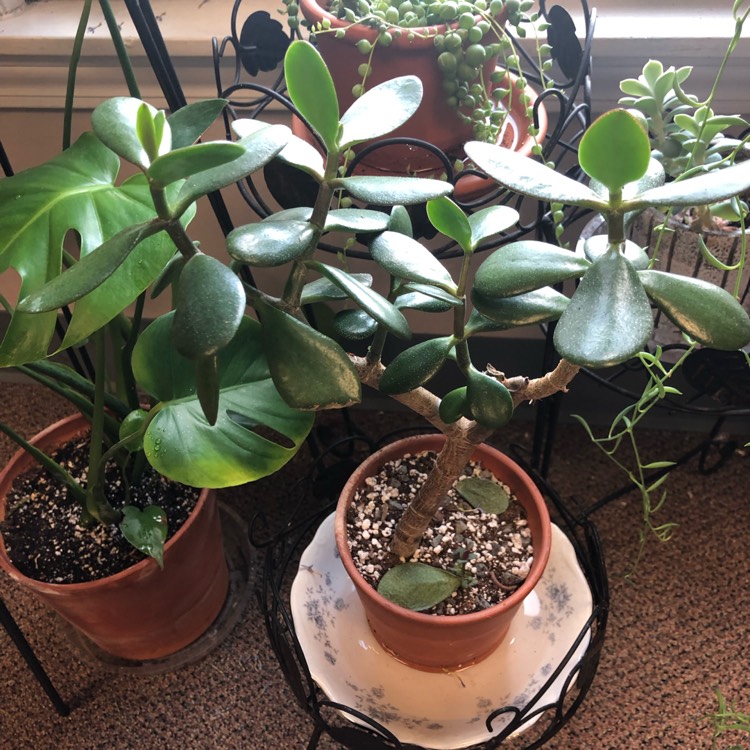
Where is `window sill`? The image size is (750, 750). window sill is located at coordinates (666, 19).